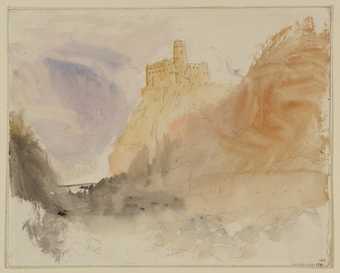
Locate an element on the screen. The width and height of the screenshot is (340, 273). light color paint is located at coordinates (157, 94).